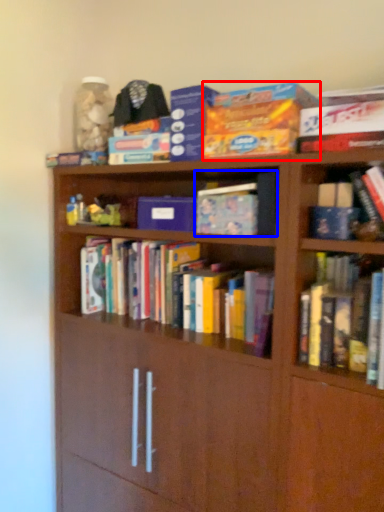
Question: Which point is further to the camera, paperback book (highlighted by a red box) or book (highlighted by a blue box)?

Choices:
 (A) paperback book
 (B) book

Answer: (B)